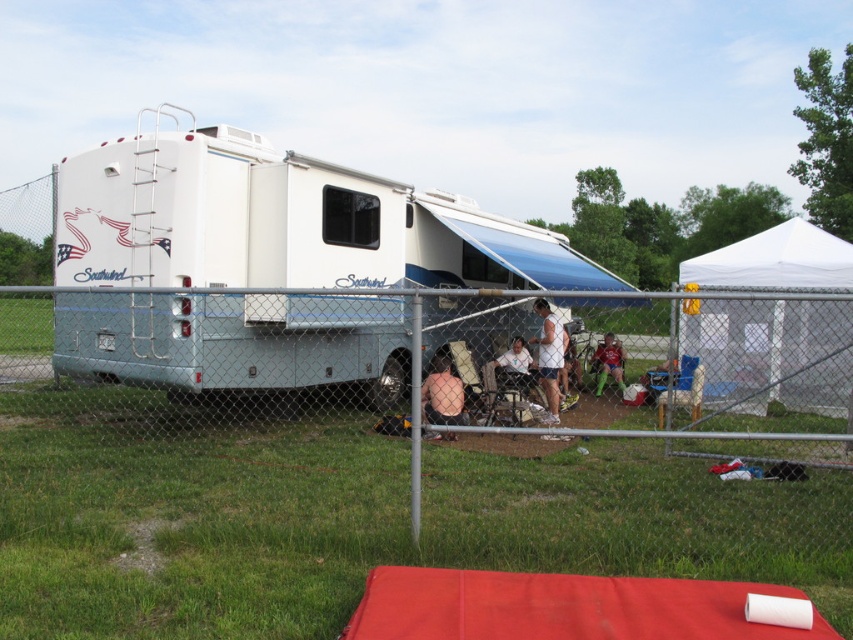
In the scene shown: You are standing in front of the white glossy recreational vehicle at center and the white fabric shirt at center. Which object is located to the left?

The white glossy recreational vehicle at center is positioned on the left side of the white fabric shirt at center, so the white glossy recreational vehicle at center is to the left.

You are standing in front of the RV and see two people under the awning wearing the white shirt at center and green mesh shorts at center. From your perspective, which clothing item is on the left?

The white shirt at center is to the left of the green mesh shorts at center.